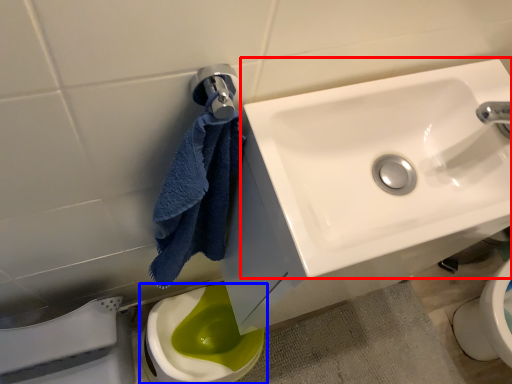
Question: Among these objects, which one is nearest to the camera, sink (highlighted by a red box) or toilet (highlighted by a blue box)?

Choices:
 (A) sink
 (B) toilet

Answer: (A)